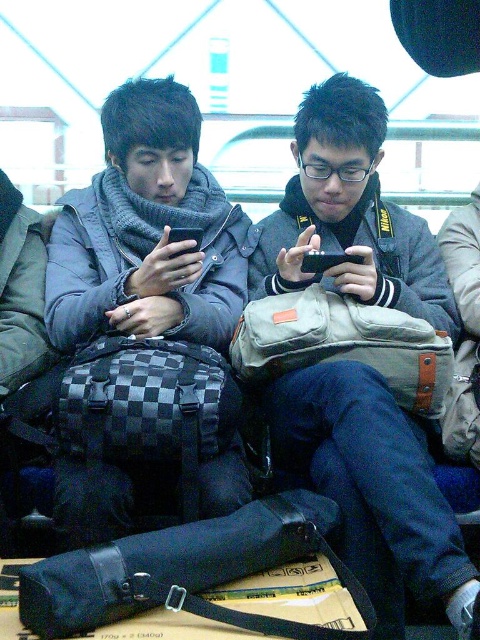
Can you confirm if matte gray jacket at center is thinner than black matte smartphone at center?

In fact, matte gray jacket at center might be wider than black matte smartphone at center.

Between point (425, 592) and point (359, 253), which one is positioned in front?

Positioned in front is point (425, 592).

Locate an element on the screen. This screenshot has width=480, height=640. matte gray jacket at center is located at coordinates (373, 486).

Locate an element on the screen. This screenshot has width=480, height=640. matte gray jacket at center is located at coordinates (373, 486).

This screenshot has height=640, width=480. Describe the element at coordinates (373, 486) in the screenshot. I see `matte gray jacket at center` at that location.

You are a GUI agent. You are given a task and a screenshot of the screen. Output one action in this format:
    pyautogui.click(x=<x>, y=<y>)
    Task: Click on the matte gray jacket at center
    The width and height of the screenshot is (480, 640).
    Given the screenshot: What is the action you would take?
    pyautogui.click(x=373, y=486)

Locate an element on the screen. This screenshot has width=480, height=640. matte gray jacket at center is located at coordinates (373, 486).

Between checkered fabric backpack at left and canvas messenger bag at center, which one has more height?

canvas messenger bag at center is taller.

Consider the image. Does checkered fabric backpack at left have a greater height compared to canvas messenger bag at center?

No.

Find the location of a particular element. checkered fabric backpack at left is located at coordinates (146, 401).